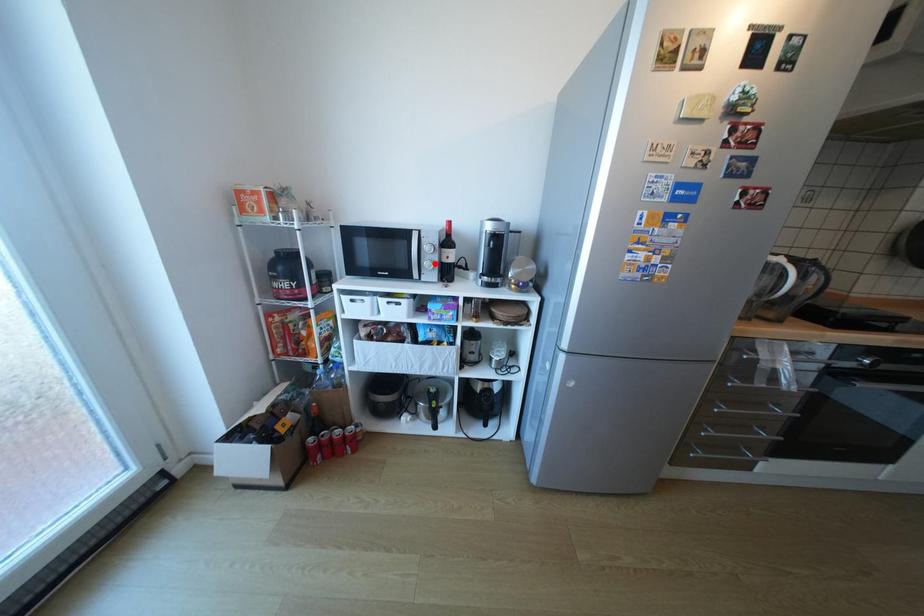
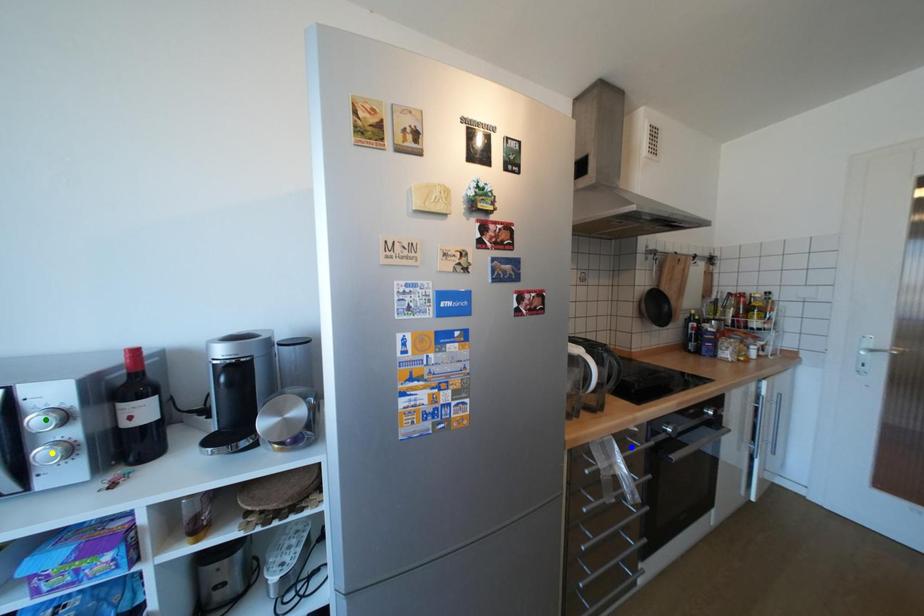
Question: I am providing you with two images of the same scene from different viewpoints. A red point is marked on the first image. You are given multiple points on the second image. Can you choose the point in image 2 that corresponds to the point in image 1?

Choices:
 (A) green point
 (B) yellow point
 (C) blue point

Answer: (B)